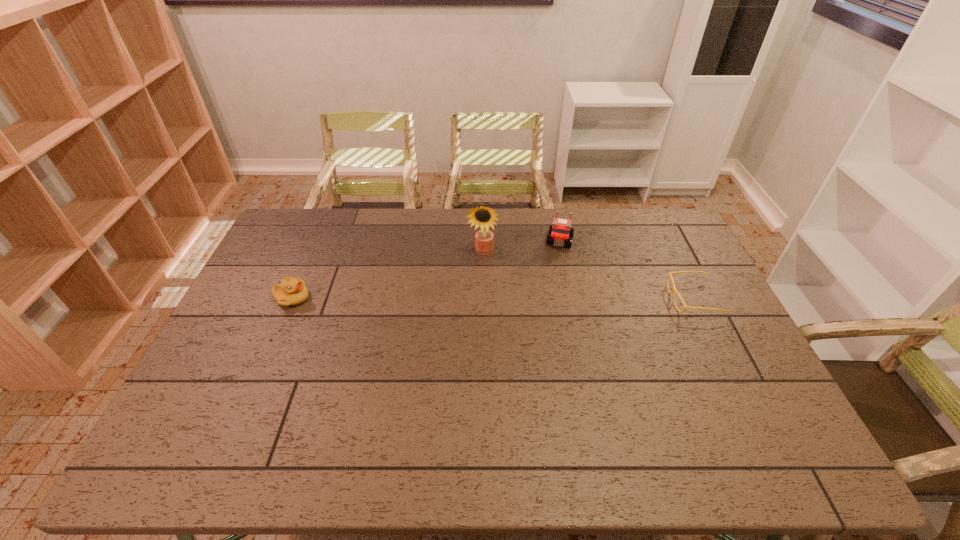
Find the location of a particular element. The width and height of the screenshot is (960, 540). the third tallest object is located at coordinates (292, 291).

Where is `the leftmost object`? the leftmost object is located at coordinates (292, 291).

The height and width of the screenshot is (540, 960). I want to click on the rightmost object, so click(674, 288).

Identify the location of spectacles. (674, 288).

Identify the location of sunflower. (484, 239).

Where is `the second object from left to right`? Image resolution: width=960 pixels, height=540 pixels. the second object from left to right is located at coordinates (484, 239).

This screenshot has height=540, width=960. I want to click on Lego, so click(x=560, y=232).

Identify the location of the second tallest object. This screenshot has width=960, height=540. (560, 232).

Locate an element on the screen. vacant area situated on the front-facing side of the duckling is located at coordinates (379, 299).

At what (x,y) coordinates should I click in order to perform the action: click on free space located in front of the lenses of the rightmost object. Please return your answer as a coordinate pair (x, y). This screenshot has width=960, height=540. Looking at the image, I should click on (630, 299).